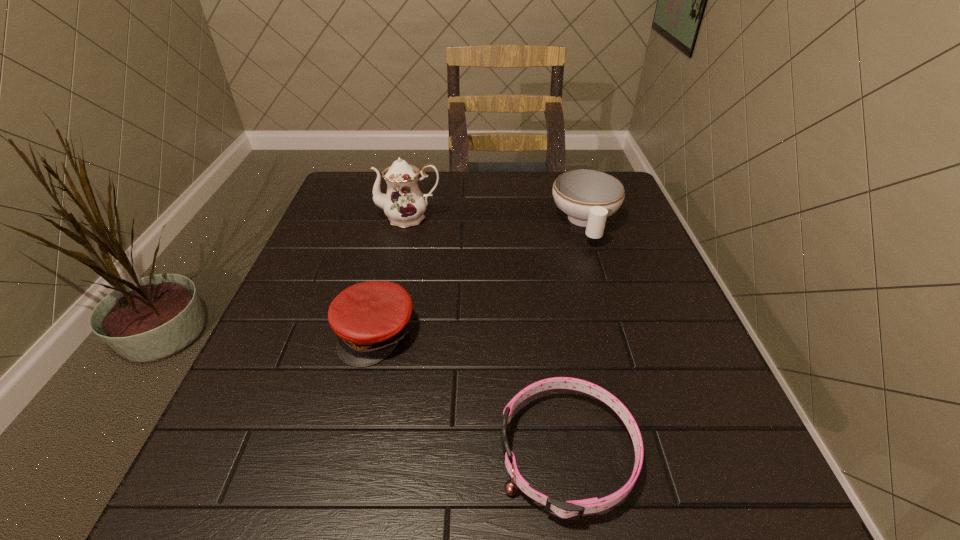
The height and width of the screenshot is (540, 960). Identify the location of vacant space in between the taller chinaware and the third shortest object. (497, 220).

This screenshot has height=540, width=960. Find the location of `vacant area that lies between the cap and the shorter chinaware`. vacant area that lies between the cap and the shorter chinaware is located at coordinates (480, 278).

Where is `vacant area that lies between the third shortest object and the taller chinaware`? The image size is (960, 540). vacant area that lies between the third shortest object and the taller chinaware is located at coordinates (497, 220).

In order to click on empty space between the shorter chinaware and the tallest object in this screenshot , I will do `click(497, 220)`.

In order to click on free spot between the left chinaware and the right chinaware in this screenshot , I will do `click(497, 220)`.

Identify the location of free space between the cap and the shortest object. (471, 393).

Point out which object is positioned as the third nearest to the shortest object. Please provide its 2D coordinates. Your answer should be formatted as a tuple, i.e. [(x, y)], where the tuple contains the x and y coordinates of a point satisfying the conditions above.

[(404, 204)]

Select which object appears as the third closest to the shortest object. Please provide its 2D coordinates. Your answer should be formatted as a tuple, i.e. [(x, y)], where the tuple contains the x and y coordinates of a point satisfying the conditions above.

[(404, 204)]

Identify the location of vacant position in the image that satisfies the following two spatial constraints: 1. on the side with the handle of the shorter chinaware; 2. with the buckle on the shortest object. (659, 453).